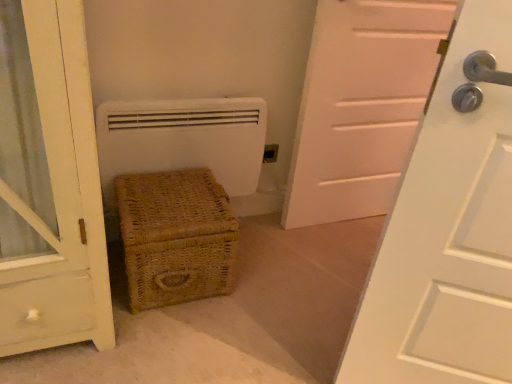
Question: Can you confirm if woven brown basket at lower left is positioned to the right of white matte heater at center?

Choices:
 (A) no
 (B) yes

Answer: (A)

Question: Considering the relative sizes of woven brown basket at lower left and white matte heater at center in the image provided, is woven brown basket at lower left shorter than white matte heater at center?

Choices:
 (A) no
 (B) yes

Answer: (B)

Question: Is woven brown basket at lower left directly adjacent to white matte heater at center?

Choices:
 (A) yes
 (B) no

Answer: (B)

Question: Considering the relative sizes of woven brown basket at lower left and white matte heater at center in the image provided, is woven brown basket at lower left wider than white matte heater at center?

Choices:
 (A) yes
 (B) no

Answer: (A)

Question: Considering the relative sizes of woven brown basket at lower left and white matte heater at center in the image provided, is woven brown basket at lower left thinner than white matte heater at center?

Choices:
 (A) no
 (B) yes

Answer: (A)

Question: In the image, is white matte door at center on the left side or the right side of white matte heater at center?

Choices:
 (A) right
 (B) left

Answer: (A)

Question: Is white matte door at center inside or outside of white matte heater at center?

Choices:
 (A) outside
 (B) inside

Answer: (A)

Question: Considering the positions of point (406, 112) and point (189, 102), is point (406, 112) closer or farther from the camera than point (189, 102)?

Choices:
 (A) farther
 (B) closer

Answer: (A)

Question: Considering the positions of white matte door at center and white matte heater at center in the image, is white matte door at center wider or thinner than white matte heater at center?

Choices:
 (A) wide
 (B) thin

Answer: (A)

Question: Looking at the image, does white matte heater at center seem bigger or smaller compared to woven brown basket at lower left?

Choices:
 (A) big
 (B) small

Answer: (B)

Question: Which is correct: white matte heater at center is inside woven brown basket at lower left, or outside of it?

Choices:
 (A) inside
 (B) outside

Answer: (B)

Question: Would you say white matte heater at center is to the left or to the right of woven brown basket at lower left in the picture?

Choices:
 (A) left
 (B) right

Answer: (B)

Question: Considering the positions of white matte heater at center and woven brown basket at lower left in the image, is white matte heater at center wider or thinner than woven brown basket at lower left?

Choices:
 (A) wide
 (B) thin

Answer: (B)

Question: Considering the positions of matte plastic electrical outlet at center and white matte heater at center in the image, is matte plastic electrical outlet at center taller or shorter than white matte heater at center?

Choices:
 (A) short
 (B) tall

Answer: (A)

Question: From the image's perspective, is matte plastic electrical outlet at center above or below white matte heater at center?

Choices:
 (A) below
 (B) above

Answer: (B)